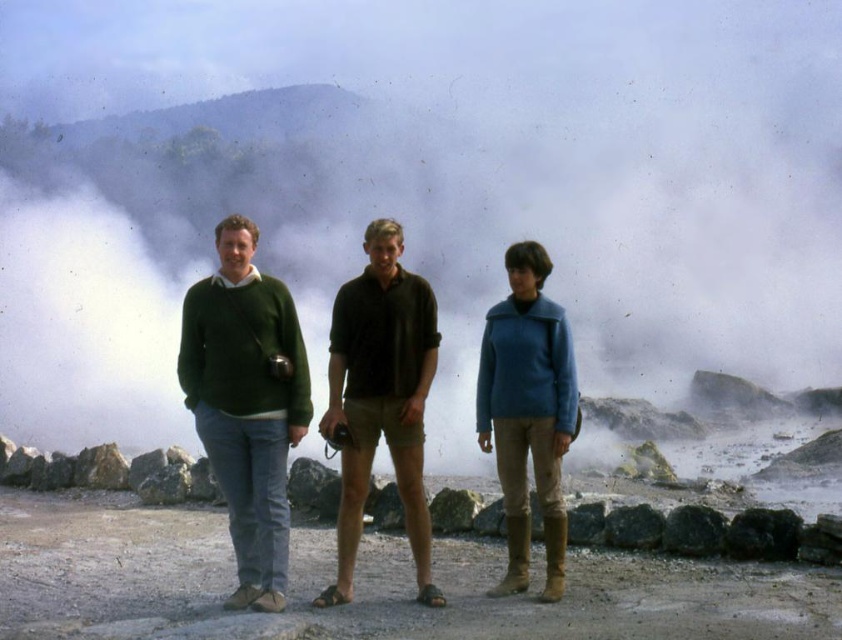
You are standing at the point labeled as point (246, 403) in the image. Which person are you closest to?

You are closest to the green sweater at left because the point (246, 403) corresponds to that person.

You are a photographer trying to capture the steam rising from the geothermal area. You see the white smoke at center and the blue woolen sweater at center. Which object is positioned to the left of the other?

The white smoke at center is to the left of the blue woolen sweater at center.

You are a photographer trying to capture a shot of the two points in the geothermal area. The points are located at coordinates point (x=260, y=26) and point (x=344, y=536). Which point is closer to the camera?

Point (x=344, y=536) is closer to the camera than point (x=260, y=26) because the description states that point (x=260, y=26) is further to the camera than point (x=344, y=536).